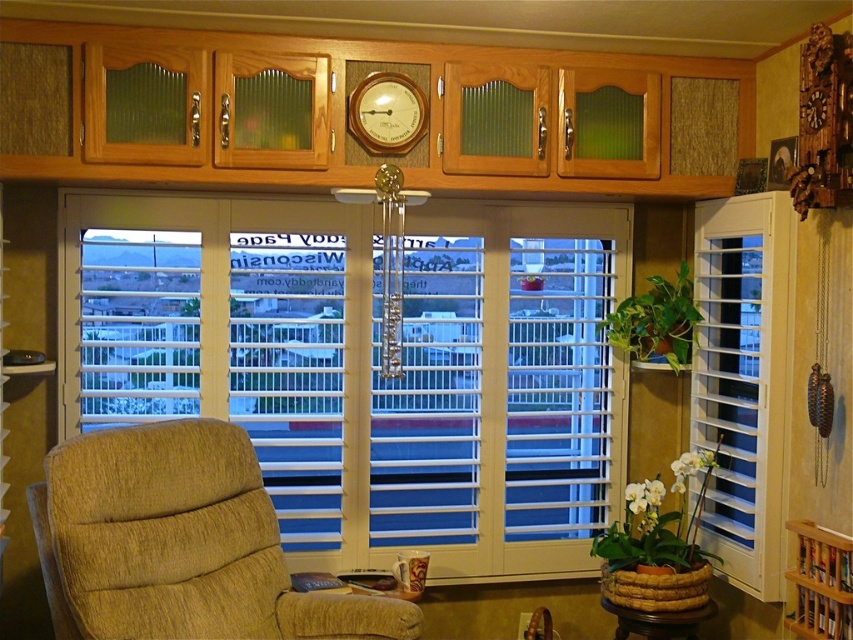
Consider the image. Which of these two, white wood blinds at center or wooden clock at upper center, stands shorter?

wooden clock at upper center is shorter.

Does point (172, 387) come in front of point (404, 113)?

No, it is not.

This screenshot has width=853, height=640. Identify the location of white wood blinds at center. (368, 365).

Is beige fabric armchair at lower left taller than wooden clock at upper center?

Yes.

In order to click on beige fabric armchair at lower left in this screenshot , I will do `click(180, 545)`.

Describe the element at coordinates (180, 545) in the screenshot. This screenshot has height=640, width=853. I see `beige fabric armchair at lower left` at that location.

Image resolution: width=853 pixels, height=640 pixels. In order to click on beige fabric armchair at lower left in this screenshot , I will do `click(180, 545)`.

Does white wood shutter at right have a larger size compared to wooden clock at upper center?

Indeed, white wood shutter at right has a larger size compared to wooden clock at upper center.

Describe the element at coordinates (744, 380) in the screenshot. I see `white wood shutter at right` at that location.

I want to click on white wood shutter at right, so click(x=744, y=380).